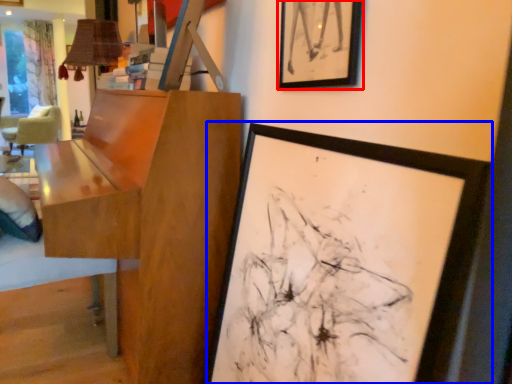
Question: Among these objects, which one is nearest to the camera, picture frame (highlighted by a red box) or picture frame (highlighted by a blue box)?

Choices:
 (A) picture frame
 (B) picture frame

Answer: (B)